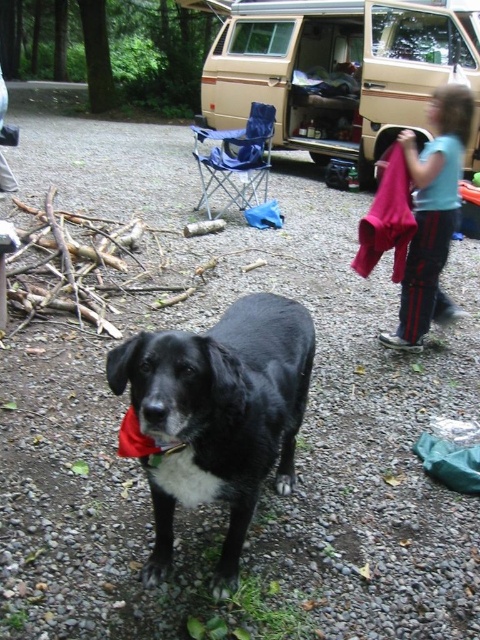
You are standing in the campsite and notice two items, the blue cotton shirt at upper right and the red fabric neckband at center. Which item is positioned more to the right side of the image?

The blue cotton shirt at upper right is positioned more to the right side of the image than the red fabric neckband at center.

What is located at the coordinates point (342,72) in the image?

The beige fabric van at center is located at point (342,72).